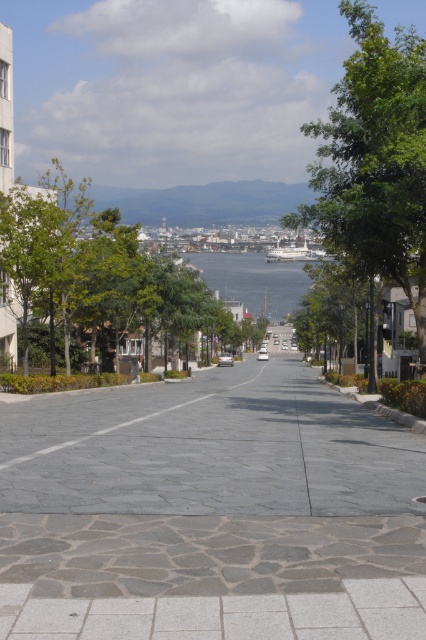
Is point (371, 129) positioned after point (46, 173)?

No, (371, 129) is in front of (46, 173).

Who is shorter, green leafy tree at right or green leafy tree at center?

With less height is green leafy tree at center.

Is point (423, 67) positioned behind point (85, 227)?

No, (423, 67) is in front of (85, 227).

Find the location of a particular element. green leafy tree at right is located at coordinates (376, 161).

Does green leafy tree at right lie behind blue water at center?

That is False.

Does point (425, 227) lie in front of point (287, 282)?

Yes.

Measure the distance between green leafy tree at right and camera.

A distance of 57.28 feet exists between green leafy tree at right and camera.

Identify the location of green leafy tree at right. (376, 161).

Who is more forward, (77, 260) or (132, 419)?

Point (132, 419) is more forward.

Can you confirm if green leafy tree at center is positioned to the right of gray stone road at center?

Incorrect, green leafy tree at center is not on the right side of gray stone road at center.

Which is behind, point (74, 305) or point (63, 449)?

Point (74, 305)

The height and width of the screenshot is (640, 426). What are the coordinates of `green leafy tree at center` in the screenshot? It's located at click(92, 269).